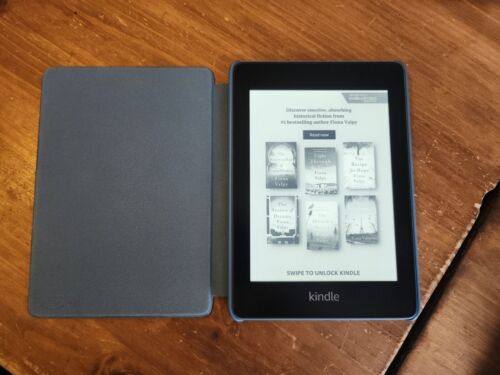
This screenshot has width=500, height=375. Find the location of `book covers`. book covers is located at coordinates (353, 173), (327, 177), (284, 169), (284, 202), (324, 216), (345, 214).